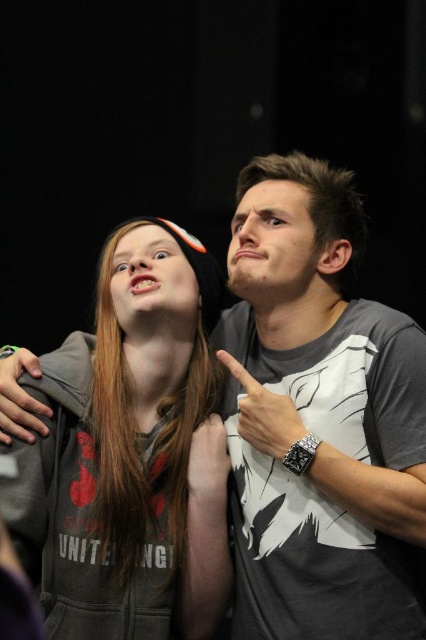
You are taking a photo of the scene described. The black leather watch at upper right is important for the composition. Where should you position your camera to ensure the watch is visible in the frame?

The black leather watch at upper right is located at point (264, 413), so position your camera to focus on the upper right area of the scene to capture the watch within the frame.

You are a photographer trying to capture a candid shot of the gray hoodie at center and the white matte hand at center. Since you want to ensure both are clearly visible, which object should you focus on first to account for their size differences?

The gray hoodie at center is larger than the white matte hand at center, so you should focus on the gray hoodie at center first to ensure its details are sharp before adjusting for the smaller white matte hand at center.

You are a photographer at the event and want to ensure that both the gray hoodie at center and the white matte hand at center are clearly visible in your photo. Based on their positions, which object should you focus on first to ensure both are in focus?

The gray hoodie at center is in front of the white matte hand at center, so focusing on the gray hoodie at center first will ensure both are in focus since it is closer to the camera.